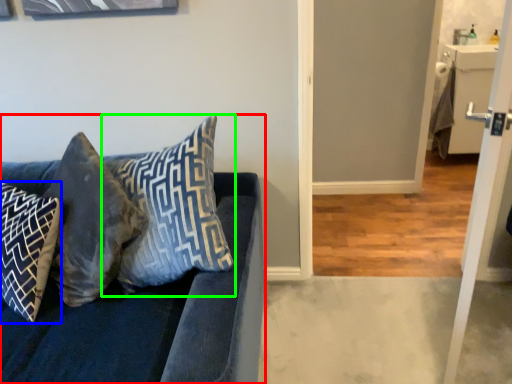
Question: Based on their relative distances, which object is farther from studio couch (highlighted by a red box)? Choose from pillow (highlighted by a blue box) and pillow (highlighted by a green box).

Choices:
 (A) pillow
 (B) pillow

Answer: (A)